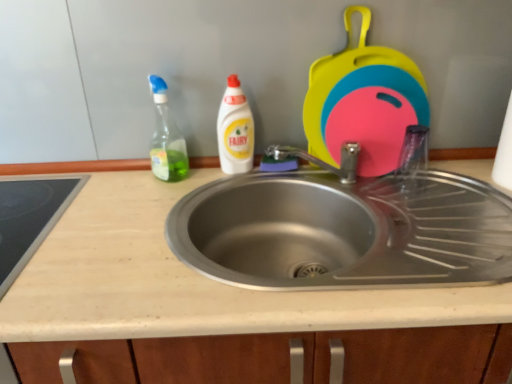
This screenshot has width=512, height=384. I want to click on blank space to the left of translucent plastic spray bottle at left, the first cleaning product when ordered from left to right, so click(104, 185).